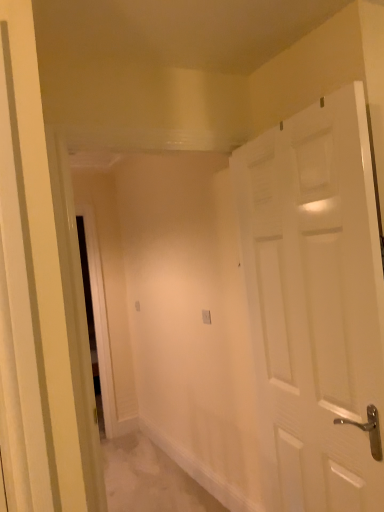
Question: Would you say white plastic electric outlet at center is to the left or to the right of white matte door at right in the picture?

Choices:
 (A) left
 (B) right

Answer: (A)

Question: Looking at the image, does white plastic electric outlet at center seem bigger or smaller compared to white matte door at right?

Choices:
 (A) small
 (B) big

Answer: (A)

Question: Choose the correct answer: Is white plastic electric outlet at center inside white matte door at right or outside it?

Choices:
 (A) outside
 (B) inside

Answer: (A)

Question: Is white matte door at right situated inside white plastic electric outlet at center or outside?

Choices:
 (A) outside
 (B) inside

Answer: (A)

Question: Considering the positions of white matte door at right and white plastic electric outlet at center in the image, is white matte door at right taller or shorter than white plastic electric outlet at center?

Choices:
 (A) tall
 (B) short

Answer: (A)

Question: Looking at the image, does white matte door at right seem bigger or smaller compared to white plastic electric outlet at center?

Choices:
 (A) small
 (B) big

Answer: (B)

Question: In the image, is white matte door at right positioned in front of or behind white plastic electric outlet at center?

Choices:
 (A) front
 (B) behind

Answer: (A)